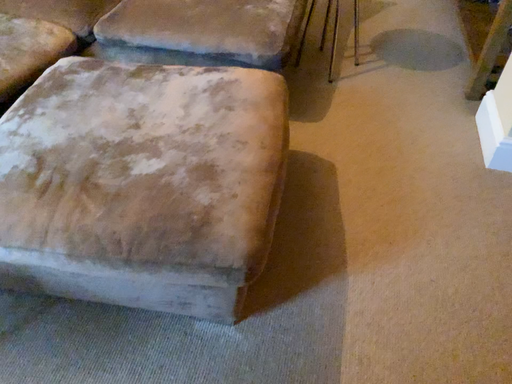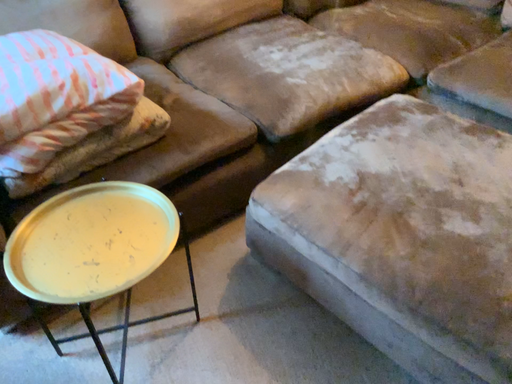
Question: How did the camera likely rotate when shooting the video?

Choices:
 (A) rotated right
 (B) rotated left

Answer: (B)